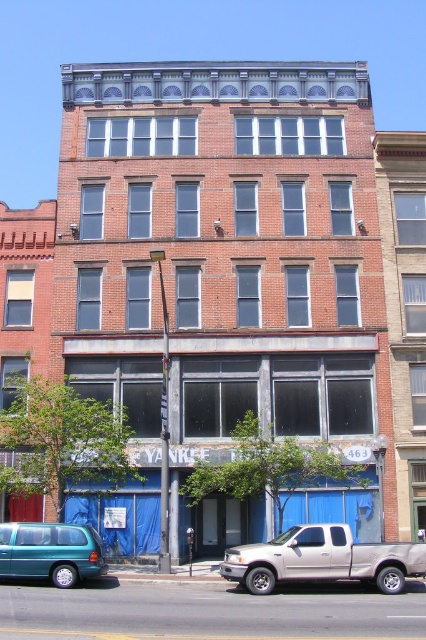
Does silver metallic truck at lower center appear under teal matte van at lower left?

Yes.

Is point (313, 564) farther from camera compared to point (62, 568)?

That is False.

Who is more forward, (x=403, y=552) or (x=43, y=557)?

Point (x=43, y=557)

The image size is (426, 640). I want to click on silver metallic truck at lower center, so click(x=322, y=560).